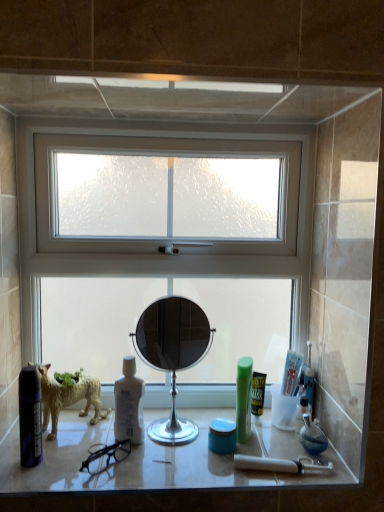
Locate an element on the screen. free space to the left of green plastic mouthwash at right, the 3th mouthwash positioned from the left is located at coordinates [196, 424].